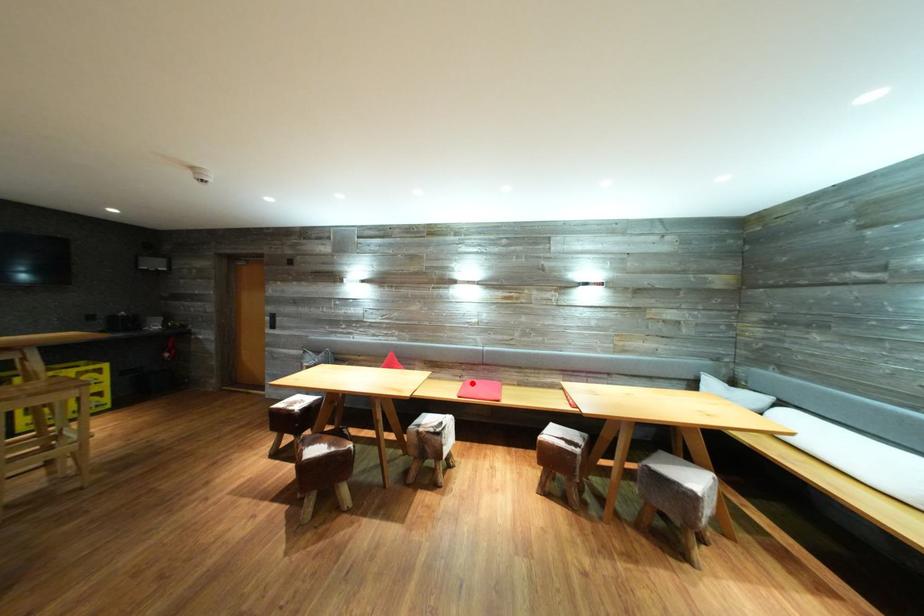
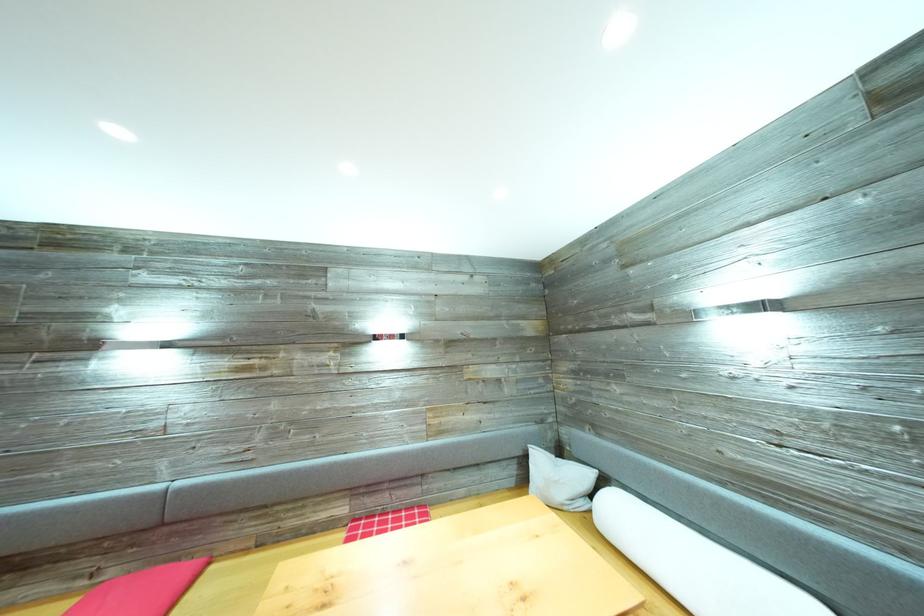
Question: I am providing you with two images of the same scene from different viewpoints. A red point is shown in image1. For the corresponding object point in image2, is it positioned nearer or farther from the camera?

Choices:
 (A) Nearer
 (B) Farther

Answer: (A)